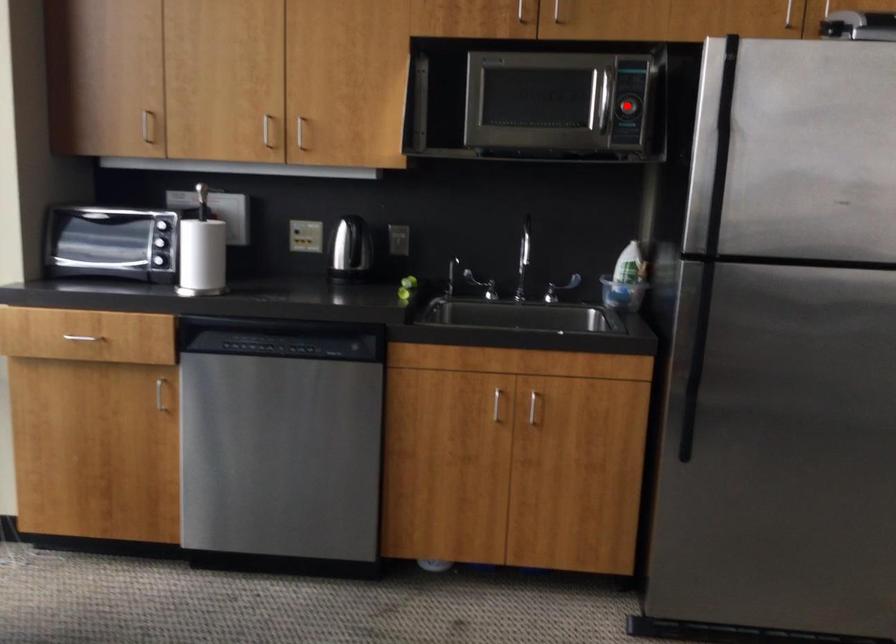
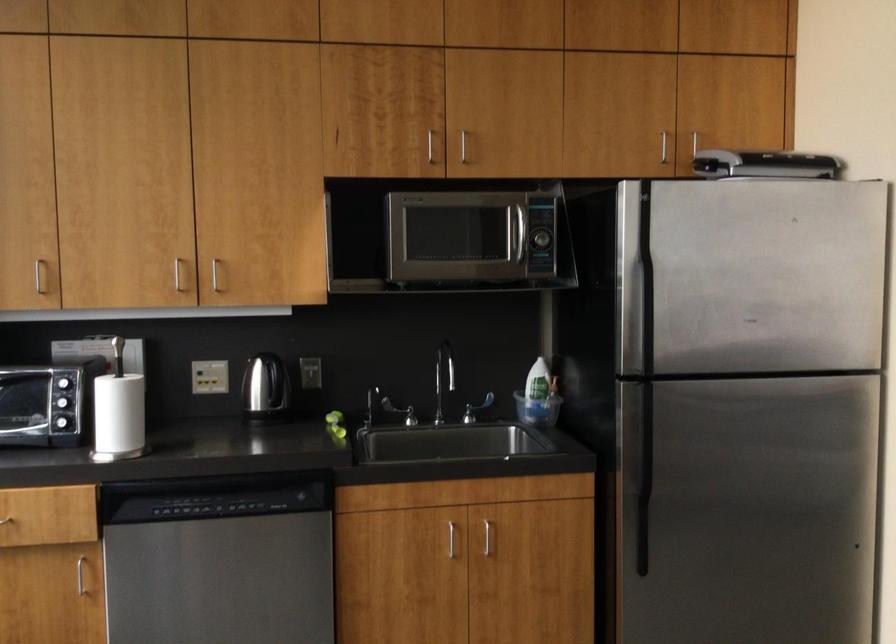
The point at the highlighted location is marked in the first image. Where is the corresponding point in the second image?

(540, 239)